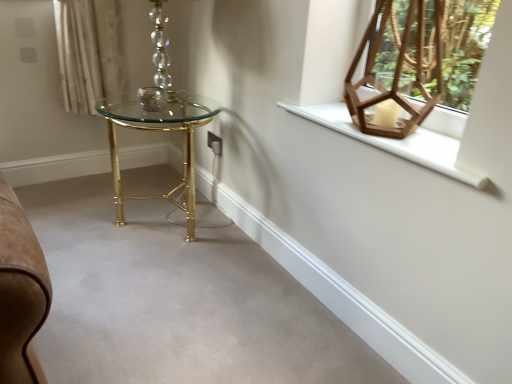
Question: Is matte glass candle holder at center situated inside wooden hexagonal lantern at upper right or outside?

Choices:
 (A) inside
 (B) outside

Answer: (B)

Question: Considering the positions of matte glass candle holder at center and wooden hexagonal lantern at upper right in the image, is matte glass candle holder at center wider or thinner than wooden hexagonal lantern at upper right?

Choices:
 (A) wide
 (B) thin

Answer: (B)

Question: Estimate the real-world distances between objects in this image. Which object is closer to the matte glass candle holder at center?

Choices:
 (A) gold metallic table at center
 (B) white wooden window sill at upper right
 (C) wooden hexagonal lantern at upper right

Answer: (A)

Question: Which object is positioned closest to the matte glass candle holder at center?

Choices:
 (A) white wooden window sill at upper right
 (B) gold metallic table at center
 (C) wooden hexagonal lantern at upper right

Answer: (B)